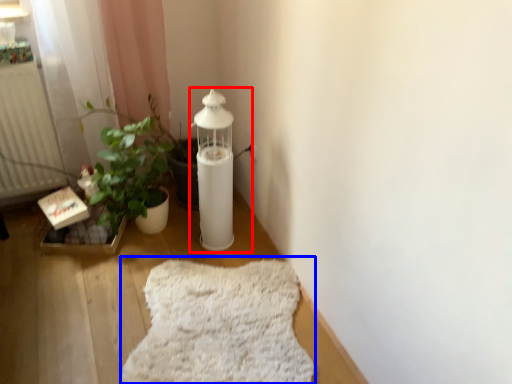
Question: Which object appears farthest to the camera in this image, oil lamp (highlighted by a red box) or blanket (highlighted by a blue box)?

Choices:
 (A) oil lamp
 (B) blanket

Answer: (A)